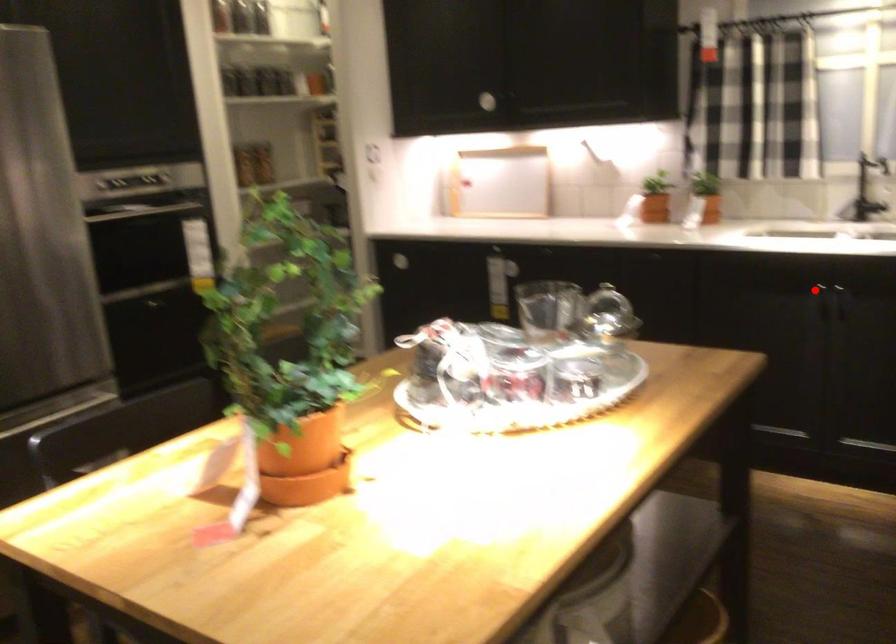
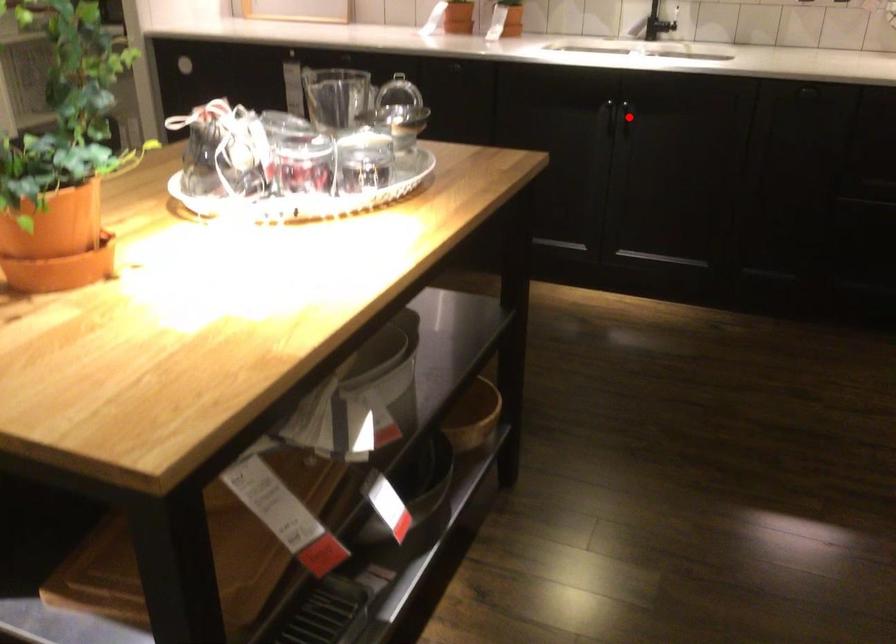
In the scene shown: I am providing you with two images of the same scene from different viewpoints. A red point is marked on the first image and another point is marked on the second image. Are the points marked in image1 and image2 representing the same 3D position?

No